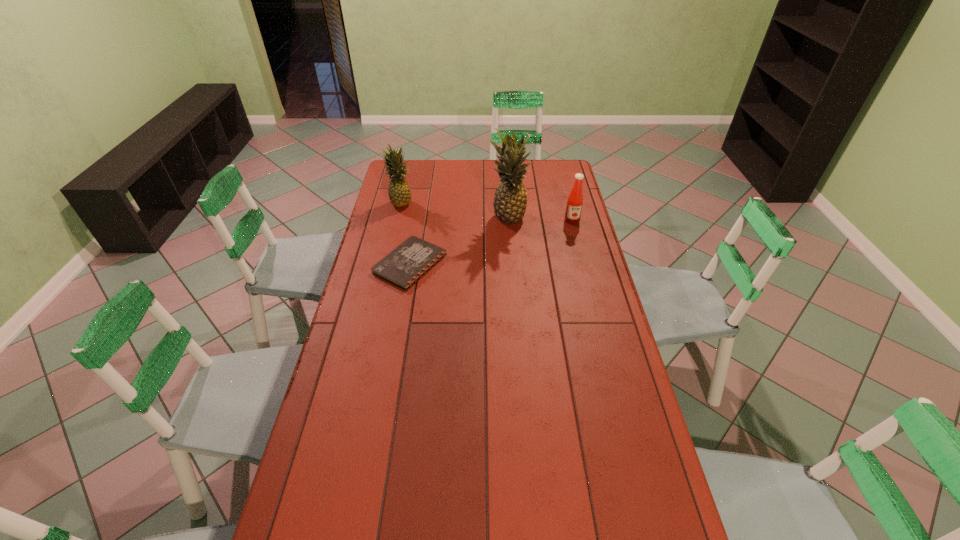
Image resolution: width=960 pixels, height=540 pixels. I want to click on the tallest object, so click(510, 200).

Find the location of a particular element. Image resolution: width=960 pixels, height=540 pixels. the third object from left to right is located at coordinates (510, 200).

This screenshot has width=960, height=540. I want to click on the left pineapple, so click(399, 192).

Find the location of `the third shortest object`. the third shortest object is located at coordinates (399, 192).

This screenshot has width=960, height=540. I want to click on the third tallest object, so click(575, 200).

Locate an element on the screen. The height and width of the screenshot is (540, 960). the rightmost object is located at coordinates (575, 200).

I want to click on the nearest object, so click(411, 260).

I want to click on notebook, so click(411, 260).

What are the coordinates of `vacant region located 0.090m on the back of the right pineapple` in the screenshot? It's located at pos(506,197).

Where is `vacant space located on the right of the second tallest object`? vacant space located on the right of the second tallest object is located at coordinates (462, 202).